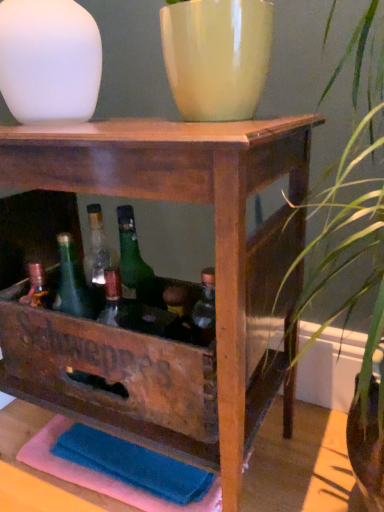
Question: Is matte green glass bottle at center taller than matte yellow vase at upper center?

Choices:
 (A) no
 (B) yes

Answer: (A)

Question: From the image's perspective, is matte green glass bottle at center located beneath matte yellow vase at upper center?

Choices:
 (A) yes
 (B) no

Answer: (A)

Question: Considering the relative positions of matte green glass bottle at center and matte yellow vase at upper center in the image provided, is matte green glass bottle at center to the left of matte yellow vase at upper center from the viewer's perspective?

Choices:
 (A) yes
 (B) no

Answer: (A)

Question: Is matte green glass bottle at center further to camera compared to matte yellow vase at upper center?

Choices:
 (A) no
 (B) yes

Answer: (B)

Question: Is matte green glass bottle at center not within matte yellow vase at upper center?

Choices:
 (A) no
 (B) yes

Answer: (B)

Question: From the image's perspective, is matte green glass bottle at center on top of matte yellow vase at upper center?

Choices:
 (A) no
 (B) yes

Answer: (A)

Question: From the image's perspective, does white matte vase at upper left appear lower than matte yellow vase at upper center?

Choices:
 (A) yes
 (B) no

Answer: (B)

Question: Considering the relative positions of white matte vase at upper left and matte yellow vase at upper center in the image provided, is white matte vase at upper left to the left of matte yellow vase at upper center from the viewer's perspective?

Choices:
 (A) yes
 (B) no

Answer: (A)

Question: Are white matte vase at upper left and matte yellow vase at upper center located far from each other?

Choices:
 (A) yes
 (B) no

Answer: (B)

Question: Considering the relative sizes of white matte vase at upper left and matte yellow vase at upper center in the image provided, is white matte vase at upper left taller than matte yellow vase at upper center?

Choices:
 (A) no
 (B) yes

Answer: (B)

Question: Is the depth of white matte vase at upper left less than that of matte yellow vase at upper center?

Choices:
 (A) no
 (B) yes

Answer: (A)

Question: Is white matte vase at upper left at the right side of matte yellow vase at upper center?

Choices:
 (A) no
 (B) yes

Answer: (A)

Question: Is matte green glass bottle at center facing away from white matte vase at upper left?

Choices:
 (A) no
 (B) yes

Answer: (A)